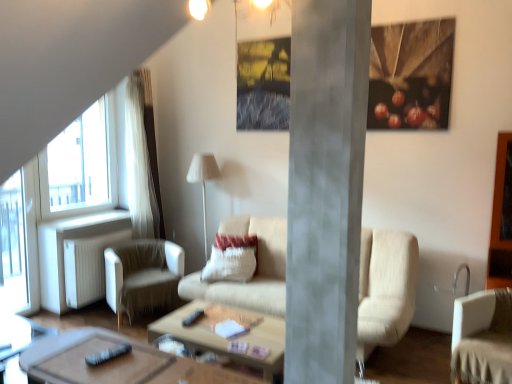
Image resolution: width=512 pixels, height=384 pixels. What do you see at coordinates (18, 344) in the screenshot? I see `wooden side table at lower left` at bounding box center [18, 344].

What is the approximate width of wooden side table at lower left?

It is 16.53 inches.

Describe the element at coordinates (13, 245) in the screenshot. I see `transparent glass window at left` at that location.

This screenshot has width=512, height=384. Describe the element at coordinates (259, 8) in the screenshot. I see `matte white light fixture at upper center` at that location.

In order to face white fabric lamp at center, should I rotate leftwards or rightwards?

Rotate left and turn 6.606 degrees.

Describe the element at coordinates (483, 338) in the screenshot. Image resolution: width=512 pixels, height=384 pixels. I see `white fabric chair at lower right, marked as the second chair in a back-to-front arrangement` at that location.

In order to click on beige fabric couch at center in this screenshot , I will do `click(385, 289)`.

Who is bigger, wooden polished coffee table at center, which appears as the second coffee table when viewed from the back, or wooden coffee table at center, the first coffee table from the back?

With larger size is wooden coffee table at center, the first coffee table from the back.

From a real-world perspective, between wooden polished coffee table at center, which is counted as the first coffee table, starting from the front, and wooden coffee table at center, the first coffee table from the back, who is vertically lower?

wooden coffee table at center, the first coffee table from the back, from a real-world perspective.

What's the angular difference between wooden polished coffee table at center, which appears as the second coffee table when viewed from the back, and wooden coffee table at center, the first coffee table from the back,'s facing directions?

They differ by 90 degrees in their facing directions.

Is wooden polished coffee table at center, which is counted as the first coffee table, starting from the front, positioned before wooden coffee table at center, the first coffee table from the back?

Yes, wooden polished coffee table at center, which is counted as the first coffee table, starting from the front, is in front of wooden coffee table at center, the first coffee table from the back.

In terms of size, does white fabric chair at lower right, arranged as the first chair when viewed from the right, appear bigger or smaller than matte white light fixture at upper center?

white fabric chair at lower right, arranged as the first chair when viewed from the right, is bigger than matte white light fixture at upper center.

From a real-world perspective, is white fabric chair at lower right, the first chair in the front-to-back sequence, positioned above or below matte white light fixture at upper center?

white fabric chair at lower right, the first chair in the front-to-back sequence, is below matte white light fixture at upper center.

Considering the relative sizes of white fabric chair at lower right, marked as the second chair in a back-to-front arrangement, and matte white light fixture at upper center in the image provided, is white fabric chair at lower right, marked as the second chair in a back-to-front arrangement, wider than matte white light fixture at upper center?

Yes, white fabric chair at lower right, marked as the second chair in a back-to-front arrangement, is wider than matte white light fixture at upper center.

Is white fabric lamp at center completely or partially inside wooden coffee table at center, marked as the 2th coffee table in a front-to-back arrangement?

No.

Image resolution: width=512 pixels, height=384 pixels. What are the coordinates of `the 1st coffee table in front of the white fabric lamp at center, starting your count from the anchor` in the screenshot? It's located at (225, 338).

Which is more to the right, wooden coffee table at center, the first coffee table from the back, or white fabric lamp at center?

wooden coffee table at center, the first coffee table from the back, is more to the right.

How far apart are wooden coffee table at center, marked as the 2th coffee table in a front-to-back arrangement, and white fabric lamp at center?

5.86 feet.

From the image's perspective, does wooden side table at lower left appear higher than white fabric chair at lower right, marked as the second chair in a back-to-front arrangement?

No, from the image's perspective, wooden side table at lower left is not above white fabric chair at lower right, marked as the second chair in a back-to-front arrangement.

Based on the photo, considering the relative sizes of wooden side table at lower left and white fabric chair at lower right, arranged as the first chair when viewed from the right, in the image provided, is wooden side table at lower left taller than white fabric chair at lower right, arranged as the first chair when viewed from the right,?

No, wooden side table at lower left is not taller than white fabric chair at lower right, arranged as the first chair when viewed from the right.

From a real-world perspective, does wooden side table at lower left sit lower than white fabric chair at lower right, the first chair in the front-to-back sequence?

Yes, from a real-world perspective, wooden side table at lower left is below white fabric chair at lower right, the first chair in the front-to-back sequence.

Is wooden side table at lower left placed right next to white fabric chair at lower right, the first chair in the front-to-back sequence?

No, wooden side table at lower left is not in contact with white fabric chair at lower right, the first chair in the front-to-back sequence.

Can you confirm if white textured pillow at center is taller than wooden polished coffee table at center, which is counted as the first coffee table, starting from the front?

Indeed, white textured pillow at center has a greater height compared to wooden polished coffee table at center, which is counted as the first coffee table, starting from the front.

Is white textured pillow at center beside wooden polished coffee table at center, which is counted as the first coffee table, starting from the front?

No.

Does point (215, 257) lie in front of point (116, 369)?

No.

Does white fabric chair at left, marked as the first chair in a back-to-front arrangement, have a greater width compared to concrete pillar at center?

Yes.

In the scene shown: Is white fabric chair at left, which appears as the 2th chair when viewed from the front, turned away from concrete pillar at center?

No, concrete pillar at center is not at the back of white fabric chair at left, which appears as the 2th chair when viewed from the front.

Considering the sizes of objects white fabric chair at left, which ranks as the 1th chair in left-to-right order, and concrete pillar at center in the image provided, who is shorter, white fabric chair at left, which ranks as the 1th chair in left-to-right order, or concrete pillar at center?

With less height is white fabric chair at left, which ranks as the 1th chair in left-to-right order.

Is point (168, 297) in front of point (308, 347)?

No.

Measure the distance between white fabric chair at lower right, marked as the second chair in a back-to-front arrangement, and white fabric lamp at center.

They are 2.67 meters apart.

Would you consider white fabric chair at lower right, the first chair in the front-to-back sequence, to be distant from white fabric lamp at center?

Yes, white fabric chair at lower right, the first chair in the front-to-back sequence, is far from white fabric lamp at center.

Does white fabric chair at lower right, marked as the second chair in a back-to-front arrangement, have a greater height compared to white fabric lamp at center?

In fact, white fabric chair at lower right, marked as the second chair in a back-to-front arrangement, may be shorter than white fabric lamp at center.

Which is correct: white fabric chair at lower right, arranged as the first chair when viewed from the right, is inside white fabric lamp at center, or outside of it?

white fabric chair at lower right, arranged as the first chair when viewed from the right, exists outside the volume of white fabric lamp at center.

What are the coordinates of `coffee table above the wooden coffee table at center, the first coffee table from the back (from the image's perspective)` in the screenshot? It's located at 116,362.

Where is `chair that is the 1st object directly below the matte white light fixture at upper center (from a real-world perspective)`? Image resolution: width=512 pixels, height=384 pixels. chair that is the 1st object directly below the matte white light fixture at upper center (from a real-world perspective) is located at coordinates (483, 338).

Based on their spatial positions, is concrete pillar at center or white fabric chair at lower right, which appears as the second chair when viewed from the left, further from white textured pillow at center?

concrete pillar at center is positioned further to the anchor white textured pillow at center.

When comparing their distances from transparent glass window at left, does wooden side table at lower left or beige fabric couch at center seem closer?

Based on the image, beige fabric couch at center appears to be nearer to transparent glass window at left.

Estimate the real-world distances between objects in this image. Which object is closer to wooden side table at lower left, white fabric lamp at center or transparent glass window at left?

transparent glass window at left lies closer to wooden side table at lower left than the other object.

From the image, which object appears to be farther from white fabric chair at left, placed as the 2th chair when sorted from right to left, wooden coffee table at center, marked as the 2th coffee table in a front-to-back arrangement, or transparent glass window at left?

Among the two, transparent glass window at left is located further to white fabric chair at left, placed as the 2th chair when sorted from right to left.

Looking at the image, which one is located closer to matte white light fixture at upper center, white fabric lamp at center or white textured pillow at center?

The object closer to matte white light fixture at upper center is white fabric lamp at center.

Estimate the real-world distances between objects in this image. Which object is closer to wooden polished coffee table at center, which appears as the second coffee table when viewed from the back, white fabric chair at lower right, arranged as the first chair when viewed from the right, or white fabric lamp at center?

white fabric chair at lower right, arranged as the first chair when viewed from the right, is positioned closer to the anchor wooden polished coffee table at center, which appears as the second coffee table when viewed from the back.

Considering their positions, is white textured pillow at center positioned closer to white fabric lamp at center than transparent glass window at left?

Based on the image, white textured pillow at center appears to be nearer to white fabric lamp at center.

Considering their positions, is wooden polished coffee table at center, which appears as the second coffee table when viewed from the back, positioned further to white textured pillow at center than concrete pillar at center?

concrete pillar at center.

Locate an element on the screen. lamp between transparent glass window at left and white fabric chair at left, which appears as the 2th chair when viewed from the front, from top to bottom is located at coordinates (203, 181).

At what (x,y) coordinates should I click in order to perform the action: click on coffee table between concrete pillar at center and wooden coffee table at center, marked as the 2th coffee table in a front-to-back arrangement, along the z-axis. Please return your answer as a coordinate pair (x, y). The width and height of the screenshot is (512, 384). Looking at the image, I should click on (116, 362).

Where is `studio couch situated between transparent glass window at left and white fabric chair at lower right, marked as the second chair in a back-to-front arrangement, from left to right`? The height and width of the screenshot is (384, 512). studio couch situated between transparent glass window at left and white fabric chair at lower right, marked as the second chair in a back-to-front arrangement, from left to right is located at coordinates (385, 289).

The width and height of the screenshot is (512, 384). I want to click on studio couch positioned between matte white light fixture at upper center and transparent glass window at left from near to far, so click(385, 289).